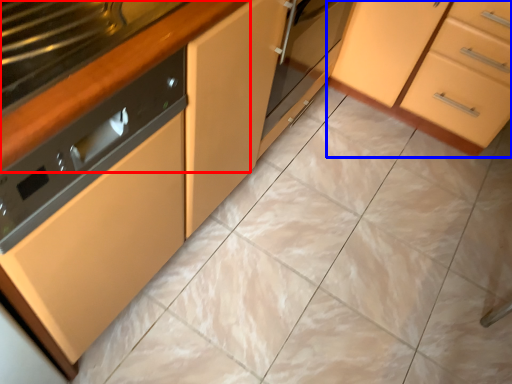
Question: Which object appears closest to the camera in this image, counter top (highlighted by a red box) or cabinetry (highlighted by a blue box)?

Choices:
 (A) counter top
 (B) cabinetry

Answer: (A)